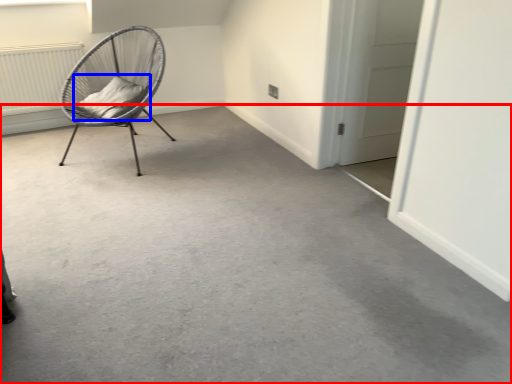
Question: Among these objects, which one is farthest to the camera, concrete (highlighted by a red box) or pillow (highlighted by a blue box)?

Choices:
 (A) concrete
 (B) pillow

Answer: (B)